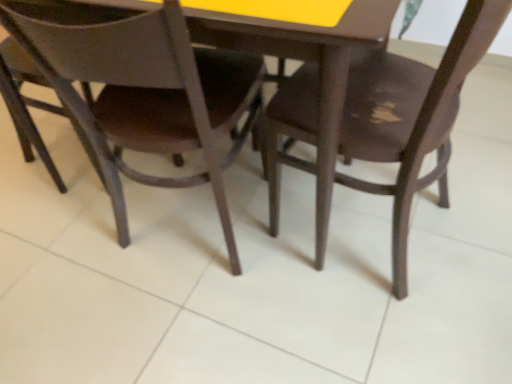
Question: From a real-world perspective, is matte brown chair at center, the 1th chair positioned from the left, located higher than dark wood chair at center, which is the 2th chair from left to right?

Choices:
 (A) yes
 (B) no

Answer: (A)

Question: Considering the relative sizes of matte brown chair at center, the 2th chair when ordered from right to left, and dark wood chair at center, which is the 2th chair from left to right, in the image provided, is matte brown chair at center, the 2th chair when ordered from right to left, wider than dark wood chair at center, which is the 2th chair from left to right,?

Choices:
 (A) no
 (B) yes

Answer: (B)

Question: Is matte brown chair at center, the 1th chair positioned from the left, oriented away from dark wood chair at center, which is the 2th chair from left to right?

Choices:
 (A) yes
 (B) no

Answer: (B)

Question: From a real-world perspective, is matte brown chair at center, the 1th chair positioned from the left, physically below dark wood chair at center, the 1th chair in the right-to-left sequence?

Choices:
 (A) yes
 (B) no

Answer: (B)

Question: Is matte brown chair at center, the 1th chair positioned from the left, completely or partially outside of dark wood chair at center, the 1th chair in the right-to-left sequence?

Choices:
 (A) no
 (B) yes

Answer: (B)

Question: Is matte brown chair at center, the 1th chair positioned from the left, surrounding dark wood chair at center, which is the 2th chair from left to right?

Choices:
 (A) yes
 (B) no

Answer: (B)

Question: Can you confirm if dark wood chair at center, the 1th chair in the right-to-left sequence, is taller than matte brown chair at center, the 2th chair when ordered from right to left?

Choices:
 (A) no
 (B) yes

Answer: (B)

Question: Can you confirm if dark wood chair at center, the 1th chair in the right-to-left sequence, is thinner than matte brown chair at center, the 2th chair when ordered from right to left?

Choices:
 (A) yes
 (B) no

Answer: (A)

Question: From a real-world perspective, is dark wood chair at center, which is the 2th chair from left to right, located higher than matte brown chair at center, the 2th chair when ordered from right to left?

Choices:
 (A) yes
 (B) no

Answer: (B)

Question: Is dark wood chair at center, the 1th chair in the right-to-left sequence, to the right of matte brown chair at center, the 1th chair positioned from the left, from the viewer's perspective?

Choices:
 (A) yes
 (B) no

Answer: (A)

Question: Can we say dark wood chair at center, which is the 2th chair from left to right, lies outside matte brown chair at center, the 2th chair when ordered from right to left?

Choices:
 (A) yes
 (B) no

Answer: (A)

Question: Is dark wood chair at center, the 1th chair in the right-to-left sequence, oriented away from matte brown chair at center, the 2th chair when ordered from right to left?

Choices:
 (A) no
 (B) yes

Answer: (A)

Question: Which is correct: matte brown chair at center, the 2th chair when ordered from right to left, is inside dark wood chair at center, the 1th chair in the right-to-left sequence, or outside of it?

Choices:
 (A) outside
 (B) inside

Answer: (A)